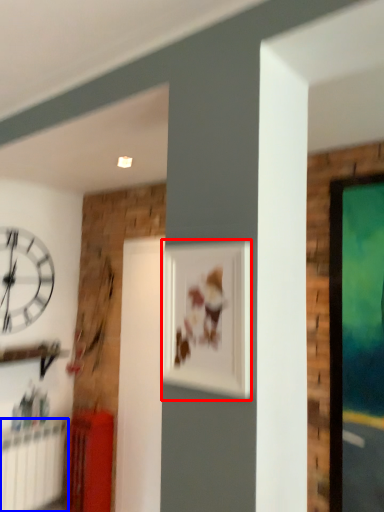
Question: Which object is further to the camera taking this photo, picture frame (highlighted by a red box) or radiator (highlighted by a blue box)?

Choices:
 (A) picture frame
 (B) radiator

Answer: (B)